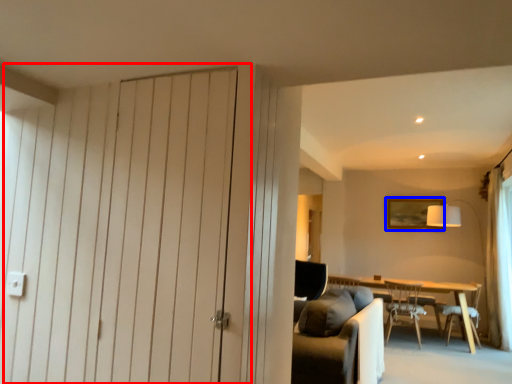
Question: Which point is closer to the camera, door (highlighted by a red box) or picture frame (highlighted by a blue box)?

Choices:
 (A) door
 (B) picture frame

Answer: (A)